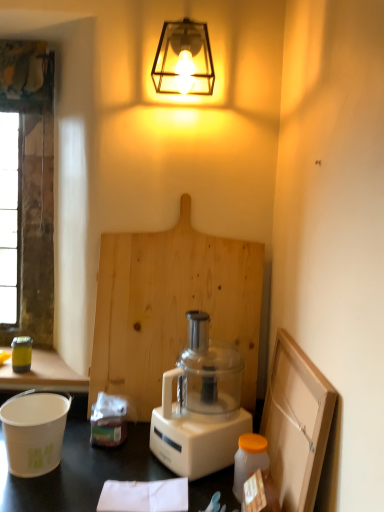
Question: Is metallic cage at upper center surrounded by natural wood cutting board at center?

Choices:
 (A) yes
 (B) no

Answer: (B)

Question: Would you consider natural wood cutting board at center to be distant from metallic cage at upper center?

Choices:
 (A) yes
 (B) no

Answer: (B)

Question: Is natural wood cutting board at center positioned before metallic cage at upper center?

Choices:
 (A) no
 (B) yes

Answer: (A)

Question: Is natural wood cutting board at center not inside metallic cage at upper center?

Choices:
 (A) no
 (B) yes

Answer: (B)

Question: From the image's perspective, is natural wood cutting board at center located above metallic cage at upper center?

Choices:
 (A) yes
 (B) no

Answer: (B)

Question: Considering the positions of point (31, 114) and point (119, 344), is point (31, 114) closer or farther from the camera than point (119, 344)?

Choices:
 (A) farther
 (B) closer

Answer: (A)

Question: Would you say glass window screen at left is to the left or to the right of natural wood cutting board at center in the picture?

Choices:
 (A) right
 (B) left

Answer: (B)

Question: In terms of width, does glass window screen at left look wider or thinner when compared to natural wood cutting board at center?

Choices:
 (A) thin
 (B) wide

Answer: (B)

Question: In terms of height, does glass window screen at left look taller or shorter compared to natural wood cutting board at center?

Choices:
 (A) tall
 (B) short

Answer: (A)

Question: From a real-world perspective, is white plastic blender at center physically located above or below glass window screen at left?

Choices:
 (A) below
 (B) above

Answer: (A)

Question: In terms of height, does white plastic blender at center look taller or shorter compared to glass window screen at left?

Choices:
 (A) tall
 (B) short

Answer: (B)

Question: Does point (231, 392) appear closer or farther from the camera than point (43, 195)?

Choices:
 (A) closer
 (B) farther

Answer: (A)

Question: Considering the positions of white plastic blender at center and glass window screen at left in the image, is white plastic blender at center wider or thinner than glass window screen at left?

Choices:
 (A) thin
 (B) wide

Answer: (B)

Question: Relative to metallic yellow canister at left, acting as the first appliance starting from the back, is white matte bucket at lower left, marked as the first appliance in a bottom-to-top arrangement, in front or behind?

Choices:
 (A) behind
 (B) front

Answer: (B)

Question: From the image's perspective, is white matte bucket at lower left, marked as the 2th appliance in a top-to-bottom arrangement, positioned above or below metallic yellow canister at left, the 2th appliance viewed from the front?

Choices:
 (A) above
 (B) below

Answer: (B)